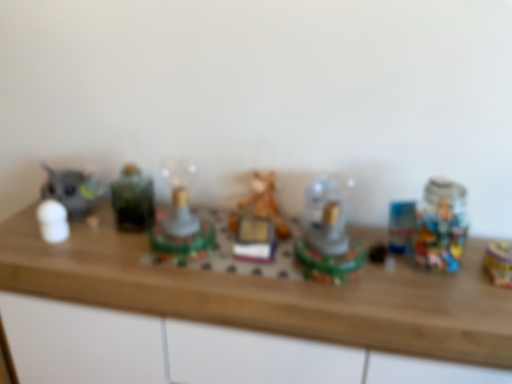
The image size is (512, 384). In order to click on free space above wooden counter top at center (from a real-world perspective) in this screenshot , I will do `click(215, 251)`.